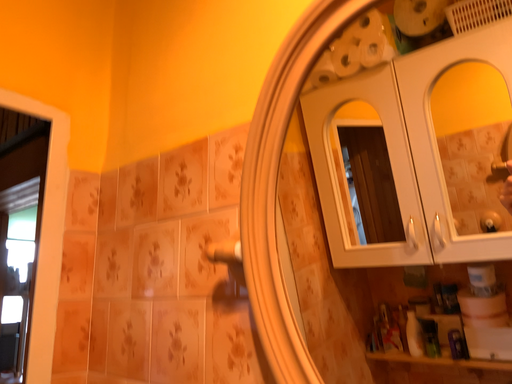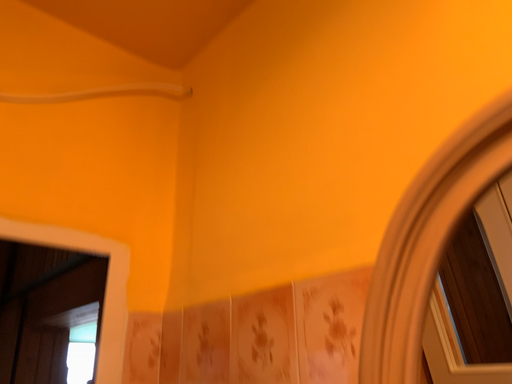
Question: How did the camera likely rotate when shooting the video?

Choices:
 (A) rotated right
 (B) rotated left

Answer: (B)